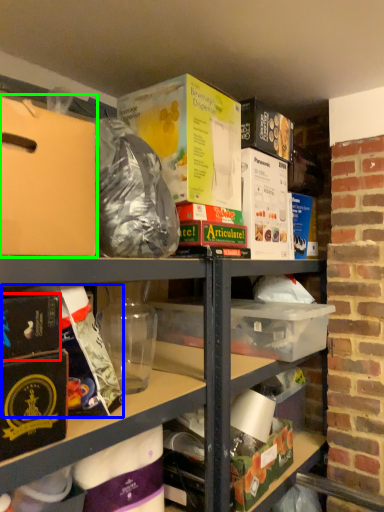
Question: Which is nearer to the paperback book (highlighted by a red box)? wrapping paper (highlighted by a blue box) or cardboard box (highlighted by a green box).

Choices:
 (A) wrapping paper
 (B) cardboard box

Answer: (A)